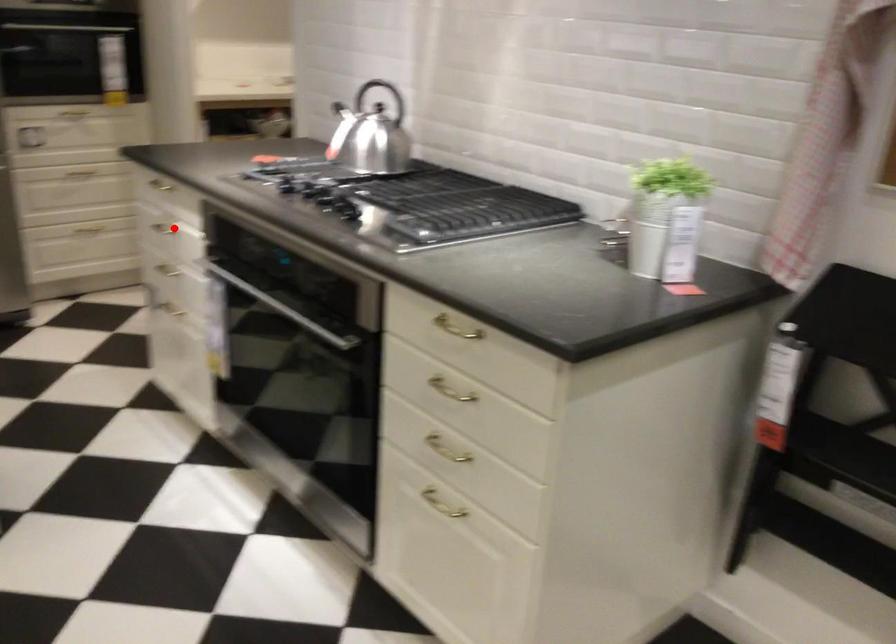
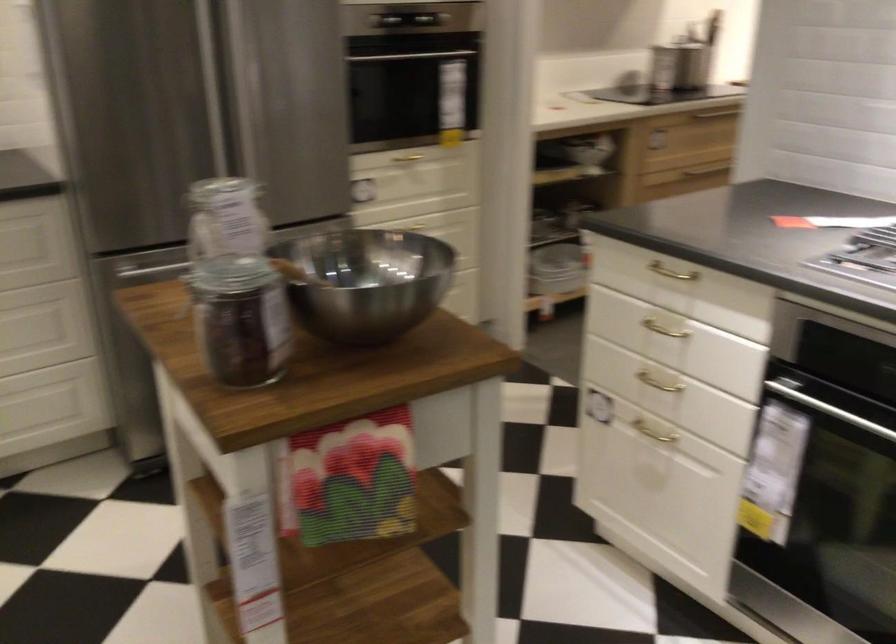
Question: I am providing you with two images of the same scene from different viewpoints. Given a red point in image1, look at the same physical point in image2. Is it:

Choices:
 (A) Closer to the viewpoint
 (B) Farther from the viewpoint

Answer: (A)